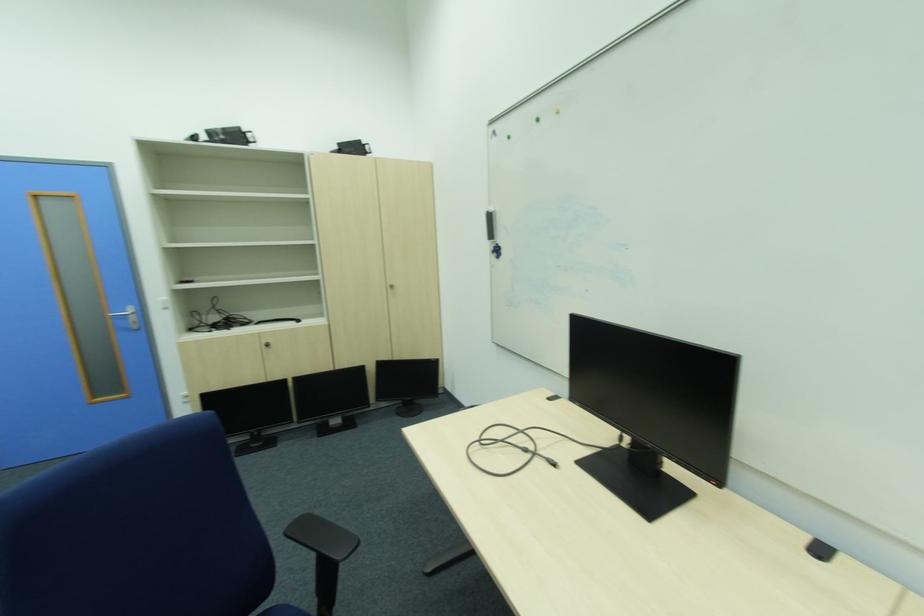
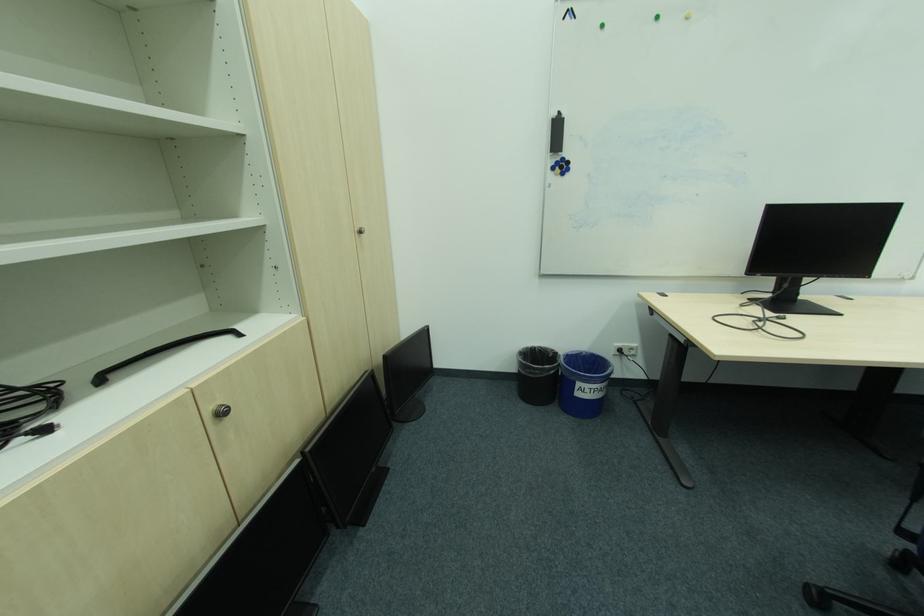
The point at (274, 346) is marked in the first image. Where is the corresponding point in the second image?

(227, 415)